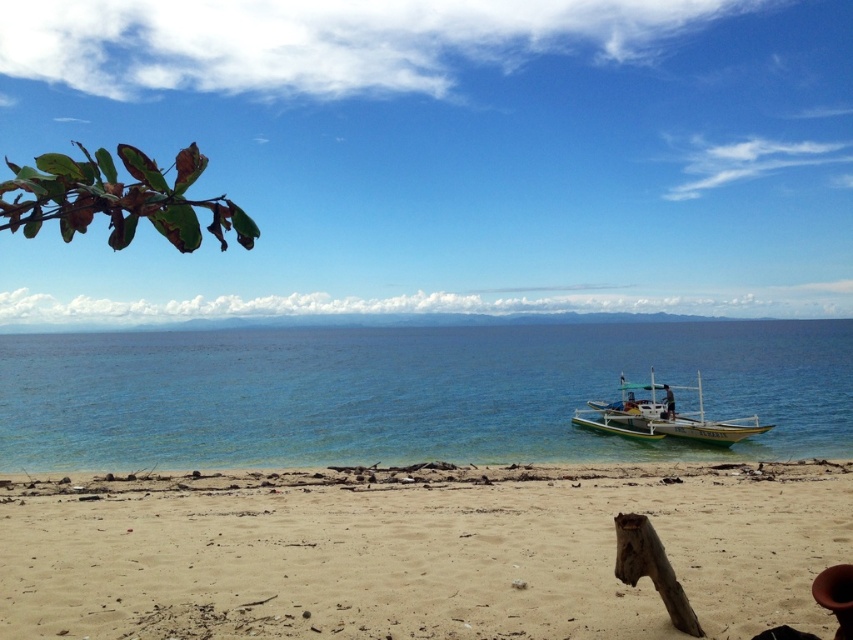
You are standing on the beach and want to take a photo of the blue clear water at center and the green wooden boat at lower right. Which object will appear taller in the photo?

The blue clear water at center appears taller in the photo because it has a greater height compared to the green wooden boat at lower right.

You are standing on the sandy beach at lower center and want to reach the green wooden boat at lower right. Which direction should you walk to get there?

You should walk to the right because the green wooden boat at lower right is located to the right of the sandy beach at lower center.